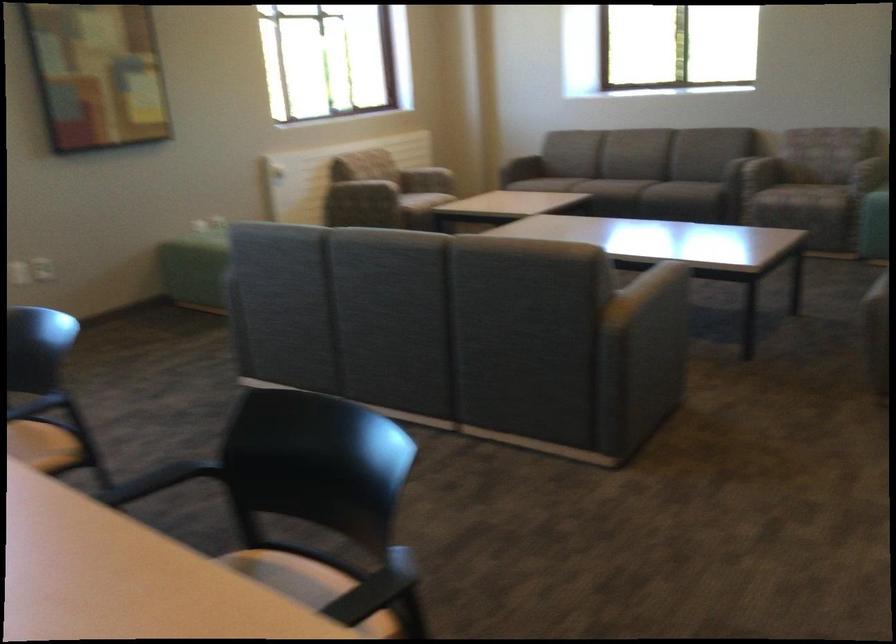
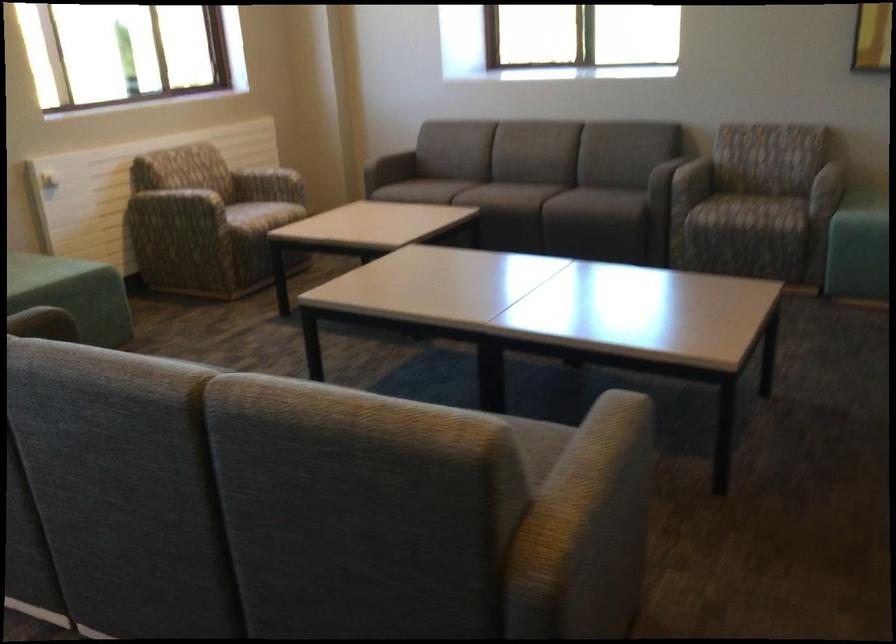
Find the pixel in the second image that matches point (760, 166) in the first image.

(693, 180)